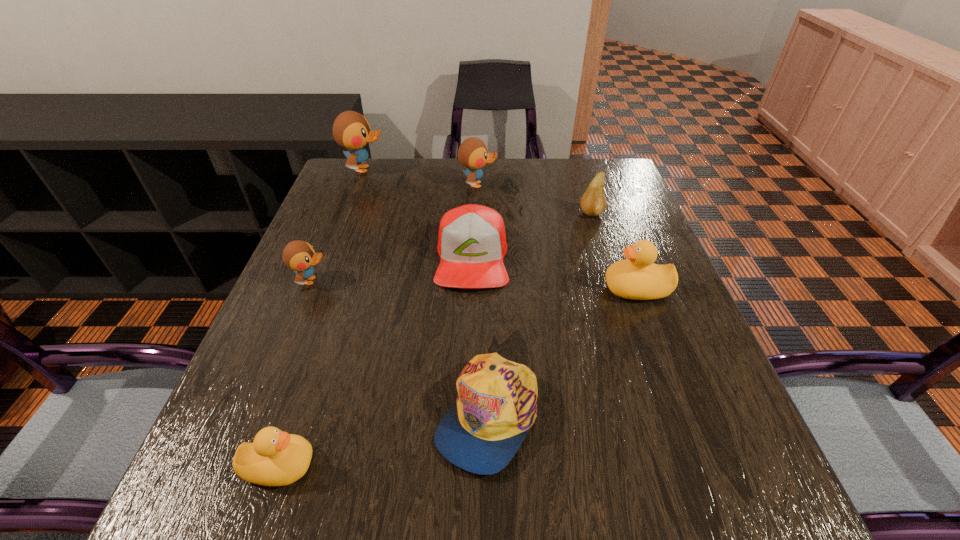
Where is `vacant space at the right edge`? The height and width of the screenshot is (540, 960). vacant space at the right edge is located at coordinates (623, 336).

This screenshot has height=540, width=960. In the image, there is a desktop. What are the coordinates of `vacant space at the far left corner` in the screenshot? It's located at (378, 170).

The height and width of the screenshot is (540, 960). In order to click on vacant area at the near left corner in this screenshot , I will do `click(221, 473)`.

You are a GUI agent. You are given a task and a screenshot of the screen. Output one action in this format:
    pyautogui.click(x=<x>, y=<y>)
    Task: Click on the vacant point at the far right corner
    The width and height of the screenshot is (960, 540).
    Given the screenshot: What is the action you would take?
    pyautogui.click(x=607, y=184)

Locate an element on the screen. This screenshot has height=540, width=960. vacant space that's between the left yellow duck and the biggest blue duck is located at coordinates click(322, 318).

Find the location of `vacant area between the red baseball cap and the nearer yellow duck`. vacant area between the red baseball cap and the nearer yellow duck is located at coordinates (375, 362).

Find the location of a particular element. This screenshot has width=960, height=540. free spot between the rightmost blue duck and the smallest blue duck is located at coordinates (395, 233).

I want to click on free space between the sixth nearest object and the right yellow duck, so pyautogui.click(x=613, y=252).

At what (x,y) coordinates should I click in order to perform the action: click on vacant area that lies between the tallest duck and the nearest blue duck. Please return your answer as a coordinate pair (x, y). The image size is (960, 540). Looking at the image, I should click on 338,225.

The height and width of the screenshot is (540, 960). In order to click on free space between the nearer yellow duck and the cap in this screenshot , I will do 383,440.